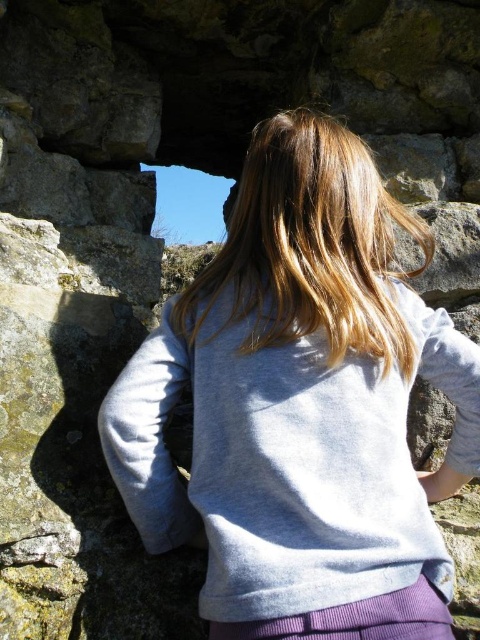
Question: Is light gray fleece at center wider than blonde silky hair at center?

Choices:
 (A) yes
 (B) no

Answer: (A)

Question: Can you confirm if light gray fleece at center is positioned to the left of blonde silky hair at center?

Choices:
 (A) yes
 (B) no

Answer: (A)

Question: Among these points, which one is farthest from the camera?

Choices:
 (A) (264, 266)
 (B) (248, 365)

Answer: (A)

Question: Which point is farther to the camera?

Choices:
 (A) blonde silky hair at center
 (B) light gray fleece at center

Answer: (A)

Question: Is light gray fleece at center to the right of blonde silky hair at center from the viewer's perspective?

Choices:
 (A) no
 (B) yes

Answer: (A)

Question: Which point is farther to the camera?

Choices:
 (A) (175, 317)
 (B) (115, 452)

Answer: (A)